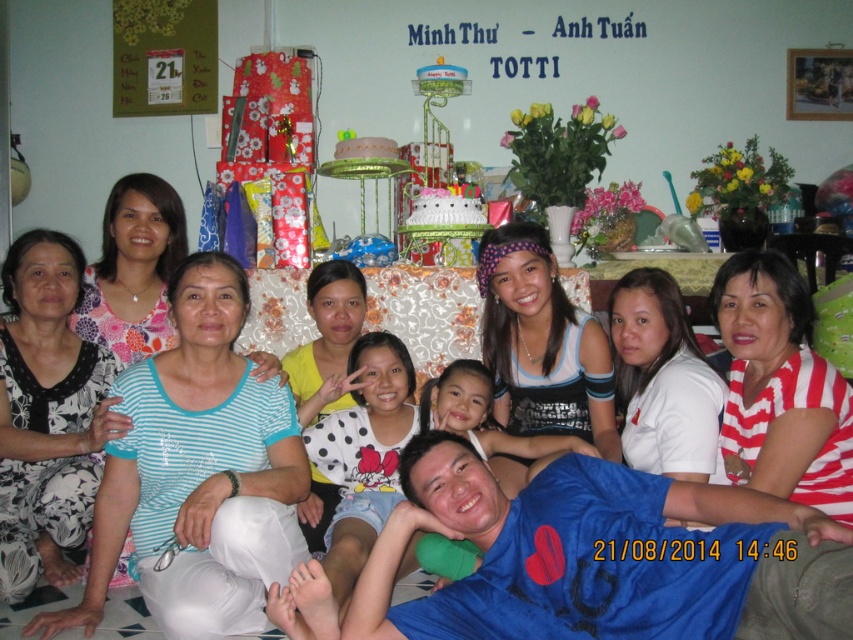
Who is lower down, white striped shirt at center or blue cotton shirt at center?

white striped shirt at center is lower down.

Is white striped shirt at center smaller than blue cotton shirt at center?

Yes.

The image size is (853, 640). Find the location of `white striped shirt at center`. white striped shirt at center is located at coordinates (198, 474).

Image resolution: width=853 pixels, height=640 pixels. Find the location of `white striped shirt at center`. white striped shirt at center is located at coordinates (198, 474).

Between white matte shirt at center and blue cotton shirt at center, which one is positioned higher?

blue cotton shirt at center

Does white matte shirt at center have a larger size compared to blue cotton shirt at center?

Incorrect, white matte shirt at center is not larger than blue cotton shirt at center.

Locate an element on the screen. white matte shirt at center is located at coordinates (662, 380).

Is black printed dress at left below white jersey at center?

Correct, black printed dress at left is located below white jersey at center.

Is black printed dress at left wider than white jersey at center?

Correct, the width of black printed dress at left exceeds that of white jersey at center.

Is point (42, 481) closer to viewer compared to point (511, 348)?

Yes, it is in front of point (511, 348).

Locate an element on the screen. black printed dress at left is located at coordinates (48, 413).